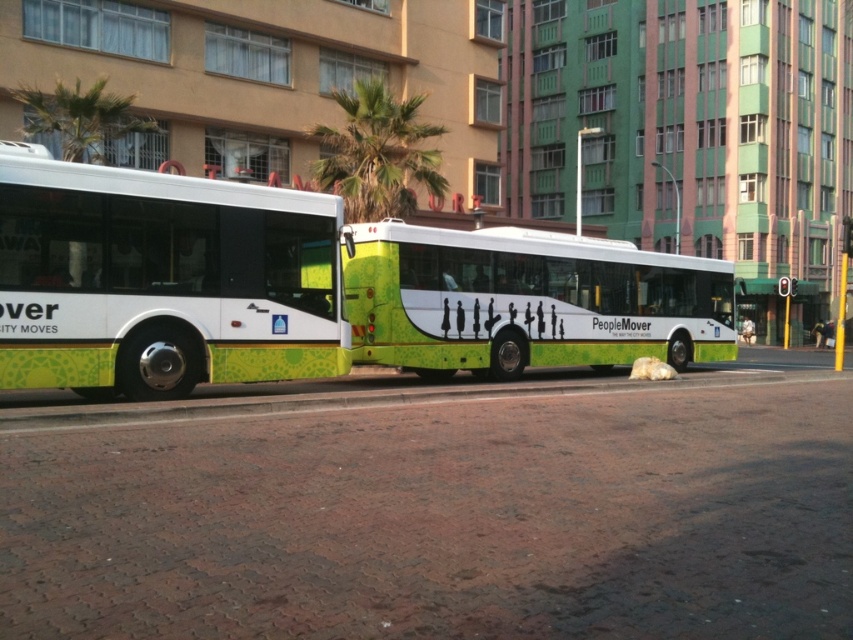
Question: Considering the real-world distances, which object is closest to the white glossy bus at center?

Choices:
 (A) green leafy palm tree at upper left
 (B) green leafy palm tree at center
 (C) green matte bus at center

Answer: (C)

Question: Is white glossy bus at center to the left of green matte bus at center from the viewer's perspective?

Choices:
 (A) yes
 (B) no

Answer: (A)

Question: Which point appears farthest from the camera in this image?

Choices:
 (A) (106, 189)
 (B) (74, 124)

Answer: (B)

Question: Is green matte bus at center thinner than green leafy palm tree at center?

Choices:
 (A) yes
 (B) no

Answer: (B)

Question: Is green matte bus at center below green leafy palm tree at upper left?

Choices:
 (A) no
 (B) yes

Answer: (B)

Question: Among these points, which one is farthest from the camera?

Choices:
 (A) (97, 90)
 (B) (416, 147)

Answer: (B)